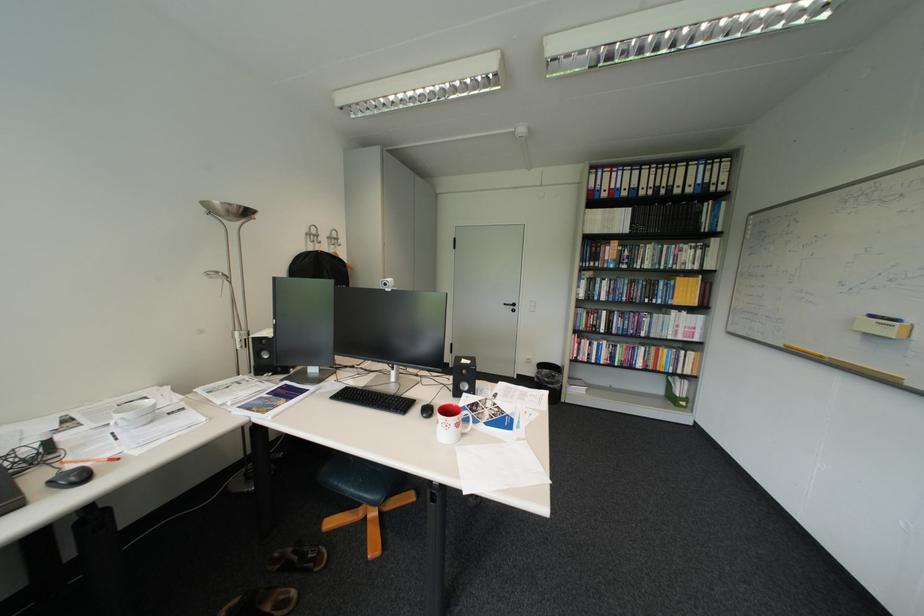
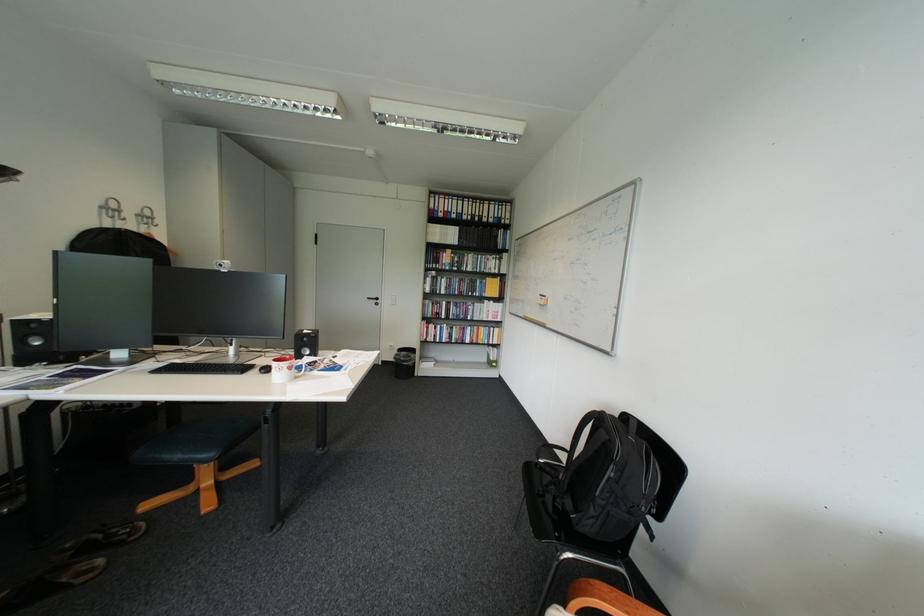
In the second image, find the point that corresponds to point (476, 371) in the first image.

(317, 339)